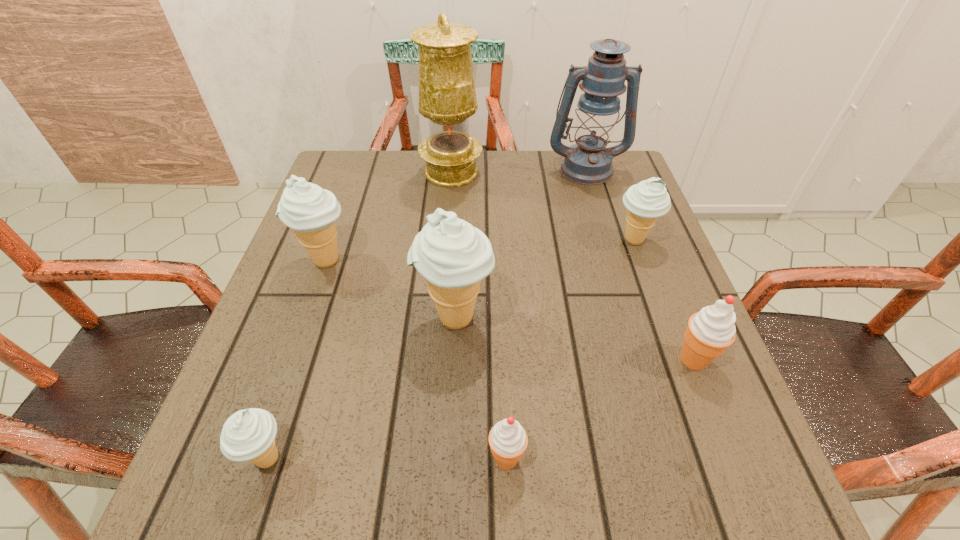
Locate an element on the screen. vacant space at the far right corner is located at coordinates [x=593, y=190].

Where is `vacant space that's between the right red icecream and the oil lamp`? Image resolution: width=960 pixels, height=540 pixels. vacant space that's between the right red icecream and the oil lamp is located at coordinates (572, 266).

You are a GUI agent. You are given a task and a screenshot of the screen. Output one action in this format:
    pyautogui.click(x=<x>, y=<y>)
    Task: Click on the vacant point located between the second biggest beige icecream and the second nearest beige icecream
    This screenshot has width=960, height=540.
    Given the screenshot: What is the action you would take?
    pyautogui.click(x=391, y=289)

You are a GUI agent. You are given a task and a screenshot of the screen. Output one action in this format:
    pyautogui.click(x=<x>, y=<y>)
    Task: Click on the free space between the left red icecream and the third smallest beige icecream
    This screenshot has height=540, width=960.
    Given the screenshot: What is the action you would take?
    (x=416, y=359)

The image size is (960, 540). I want to click on vacant space that's between the left red icecream and the third smallest beige icecream, so click(x=416, y=359).

Locate an element on the screen. Image resolution: width=960 pixels, height=540 pixels. free point between the rightmost beige icecream and the smallest beige icecream is located at coordinates (451, 349).

This screenshot has height=540, width=960. What are the coordinates of `free spot between the left red icecream and the biggest beige icecream` in the screenshot? It's located at (481, 388).

Locate an element on the screen. The image size is (960, 540). free space between the tallest icecream and the second biggest beige icecream is located at coordinates (391, 289).

Where is `free space that is in between the fourth tallest object and the right red icecream`? Image resolution: width=960 pixels, height=540 pixels. free space that is in between the fourth tallest object and the right red icecream is located at coordinates [510, 310].

The image size is (960, 540). Find the location of `the fourth closest object to the fifth shortest object`. the fourth closest object to the fifth shortest object is located at coordinates (508, 440).